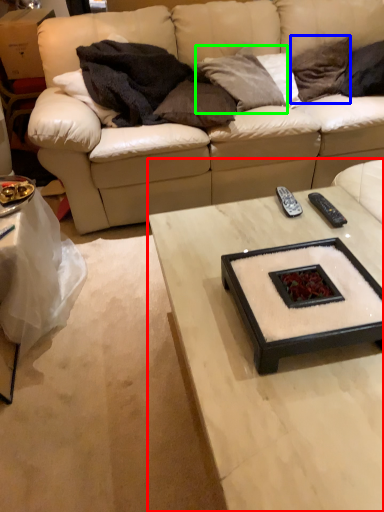
Question: Based on their relative distances, which object is nearer to coffee table (highlighted by a red box)? Choose from pillow (highlighted by a blue box) and pillow (highlighted by a green box).

Choices:
 (A) pillow
 (B) pillow

Answer: (B)